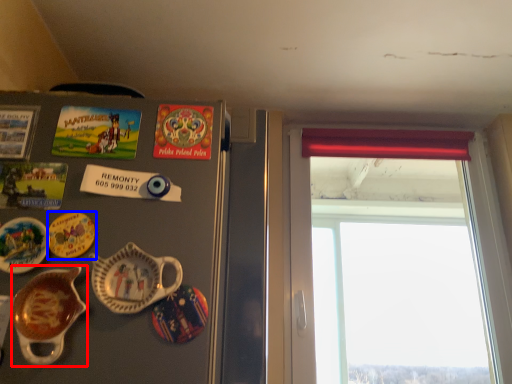
Question: Which object appears closest to the camera in this image, tableware (highlighted by a red box) or plate (highlighted by a blue box)?

Choices:
 (A) tableware
 (B) plate

Answer: (A)